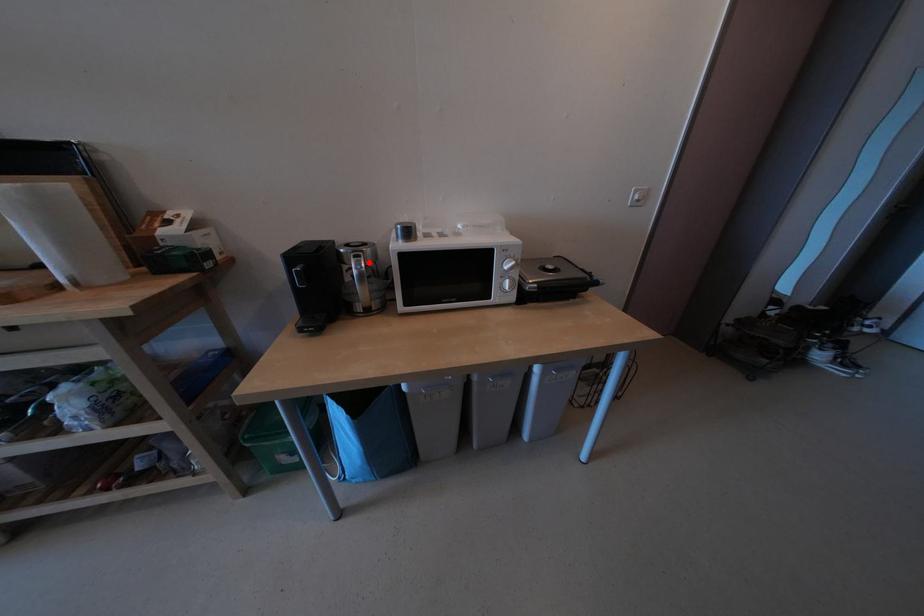
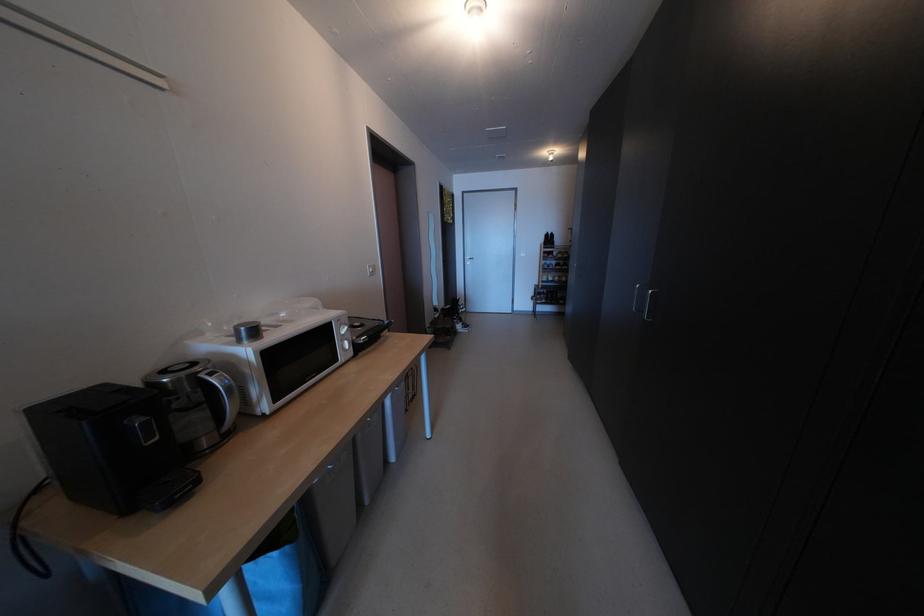
The point at the highlighted location is marked in the first image. Where is the corresponding point in the second image?

(225, 379)